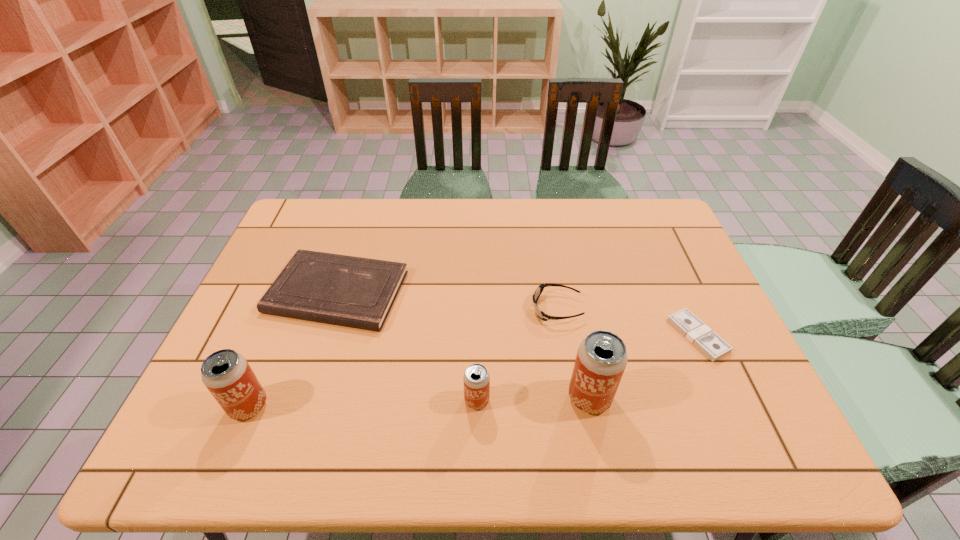
Point out which object is positioned as the fourth nearest to the rightmost object. Please provide its 2D coordinates. Your answer should be formatted as a tuple, i.e. [(x, y)], where the tuple contains the x and y coordinates of a point satisfying the conditions above.

[(357, 292)]

Locate an element on the screen. object that is the second closest to the sunglasses is located at coordinates (691, 327).

Find the location of a particular element. Image resolution: width=960 pixels, height=540 pixels. beer can that is the third closest to the rightmost object is located at coordinates (227, 375).

Identify which beer can is the nearest to the rightmost beer can. Please provide its 2D coordinates. Your answer should be formatted as a tuple, i.e. [(x, y)], where the tuple contains the x and y coordinates of a point satisfying the conditions above.

[(476, 379)]

I want to click on vacant space that satisfies the following two spatial constraints: 1. on the back side of the rightmost beer can; 2. on the left side of the second beer can from right to left, so click(477, 398).

This screenshot has height=540, width=960. In order to click on free space that satisfies the following two spatial constraints: 1. on the front side of the fourth shortest object; 2. on the left side of the paperback book in this screenshot , I will do `click(302, 401)`.

Image resolution: width=960 pixels, height=540 pixels. I want to click on free point that satisfies the following two spatial constraints: 1. on the lenses of the rightmost beer can; 2. on the right side of the sunglasses, so click(x=571, y=398).

Where is `vacant region that satisfies the following two spatial constraints: 1. on the lenses of the sunglasses; 2. on the back side of the rightmost beer can`? vacant region that satisfies the following two spatial constraints: 1. on the lenses of the sunglasses; 2. on the back side of the rightmost beer can is located at coordinates click(x=571, y=398).

I want to click on vacant space that satisfies the following two spatial constraints: 1. on the lenses of the sunglasses; 2. on the back side of the rightmost beer can, so click(x=571, y=398).